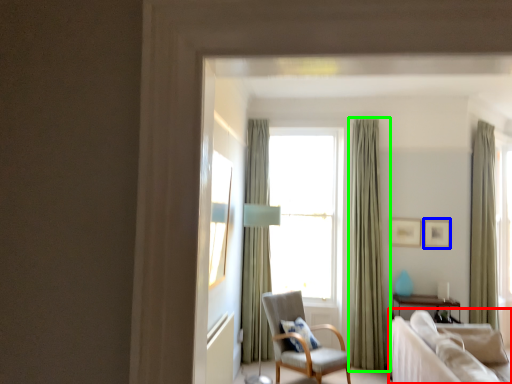
Question: Considering the real-world distances, which object is closest to studio couch (highlighted by a red box)? picture frame (highlighted by a blue box) or curtain (highlighted by a green box).

Choices:
 (A) picture frame
 (B) curtain

Answer: (B)